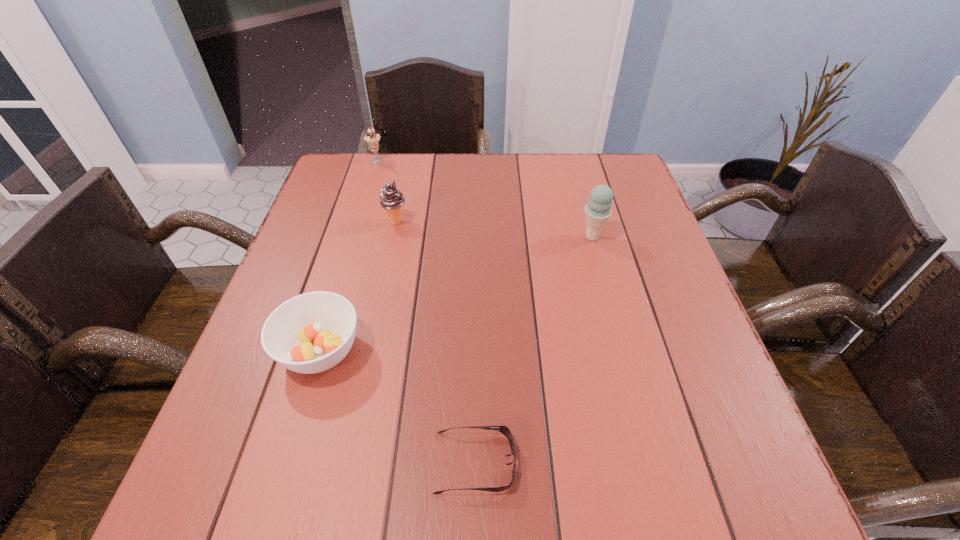
Find the location of `the rightmost icecream`. the rightmost icecream is located at coordinates (598, 210).

I want to click on the farthest object, so click(x=372, y=138).

Identify the location of the farthest icecream. (372, 138).

Identify the location of the second icecream from right to left. (392, 199).

What are the coordinates of `soup bowl` in the screenshot? It's located at (310, 333).

The image size is (960, 540). Identify the location of the fourth farthest object. (310, 333).

Where is `the fourth object from left to right`? the fourth object from left to right is located at coordinates (504, 430).

Locate an element on the screen. the nearest object is located at coordinates (504, 430).

I want to click on blank space located on the front of the rightmost object, so click(603, 278).

Where is `free space located 0.250m on the front of the farthest object`? The image size is (960, 540). free space located 0.250m on the front of the farthest object is located at coordinates (358, 220).